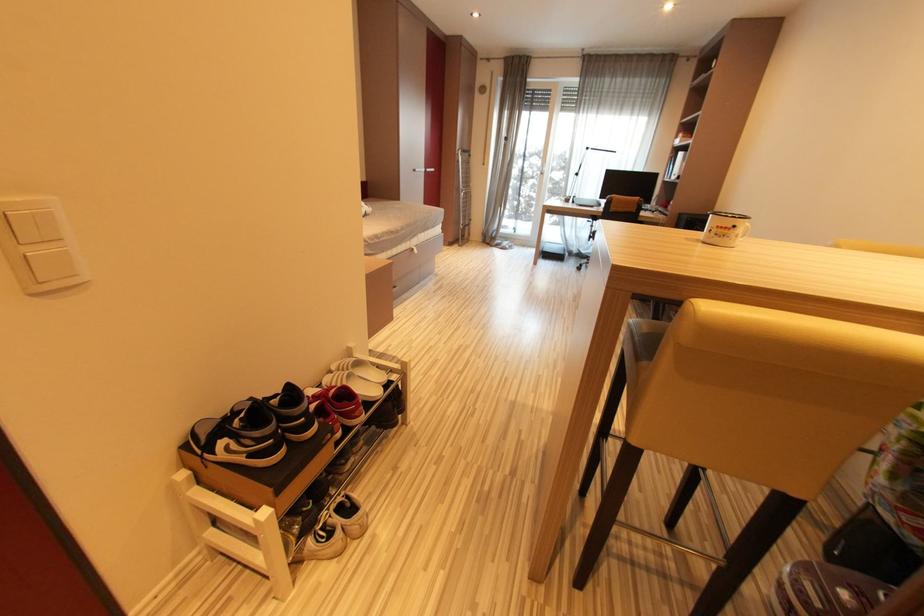
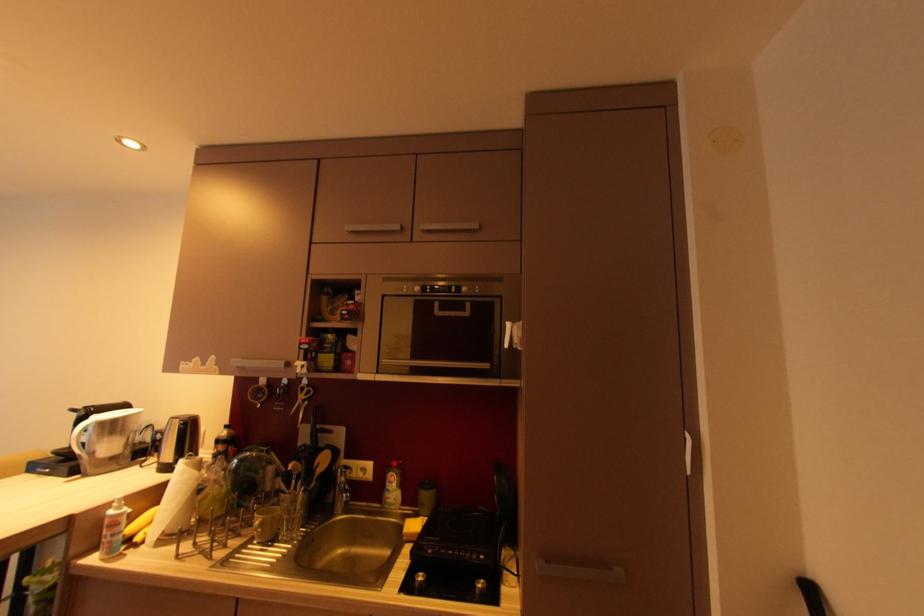
Question: The camera is either moving clockwise (left) or counter-clockwise (right) around the object. The first image is from the beginning of the video and the second image is from the end. Is the camera moving left or right when shooting the video?

Choices:
 (A) Left
 (B) Right

Answer: (A)